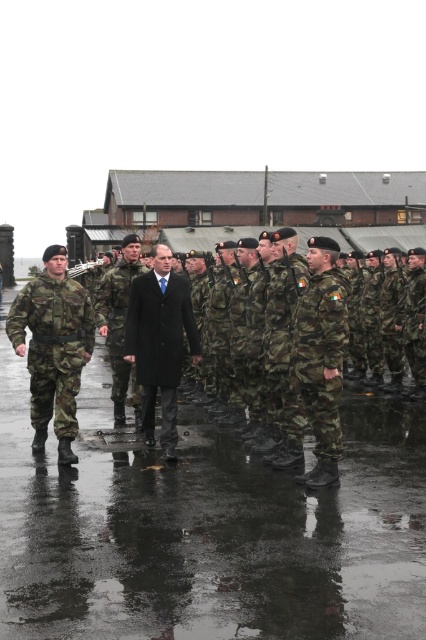
You are a photographer positioned at the edge of the ceremony area. You want to capture a clear shot of both the wet asphalt at center and the dark wool coat at center without any obstruction. Based on their sizes, is it possible to frame both objects in the same shot?

The wet asphalt at center might be wider than dark wool coat at center, so it is possible to frame both objects in the same shot as long as the camera angle accommodates the wider area of the wet asphalt at center.